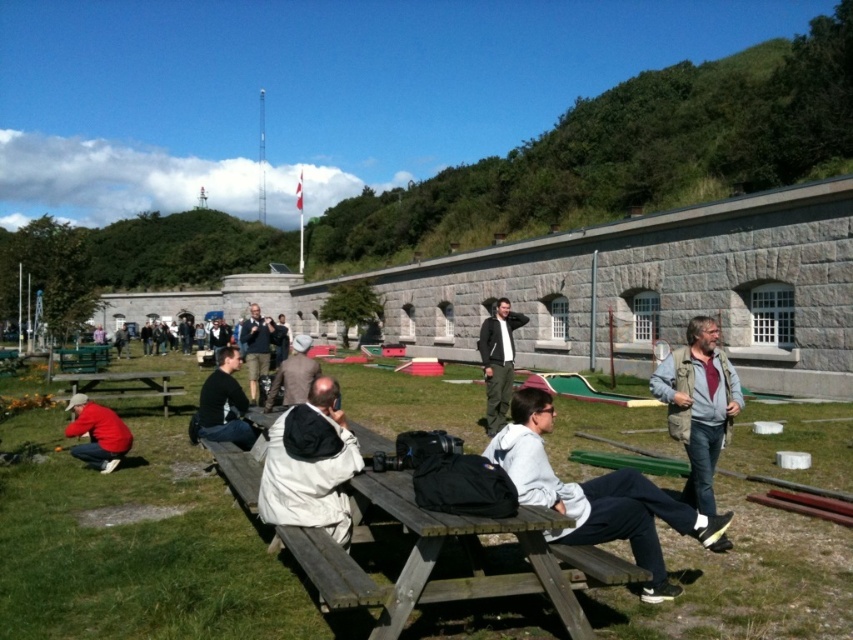
Question: Is black matte jacket at center thinner than brown leather jacket at center?

Choices:
 (A) yes
 (B) no

Answer: (A)

Question: Estimate the real-world distances between objects in this image. Which object is closer to the dark green jacket at center?

Choices:
 (A) black matte jacket at center
 (B) beige fabric jacket at center
 (C) wooden picnic table at lower left
 (D) wooden bench at center

Answer: (B)

Question: Can you confirm if light gray hoodie at center is smaller than beige fabric jacket at center?

Choices:
 (A) yes
 (B) no

Answer: (B)

Question: Which object is positioned closest to the light gray hoodie at center?

Choices:
 (A) dark blue jacket at center
 (B) matte red jacket at lower left
 (C) wooden picnic table at lower left
 (D) black matte jacket at center

Answer: (D)

Question: Which of the following is the farthest from the observer?

Choices:
 (A) light gray hoodie at center
 (B) black matte jacket at center
 (C) brown leather jacket at center
 (D) wooden bench at center

Answer: (B)

Question: Is beige fabric jacket at center smaller than brown leather jacket at center?

Choices:
 (A) yes
 (B) no

Answer: (A)